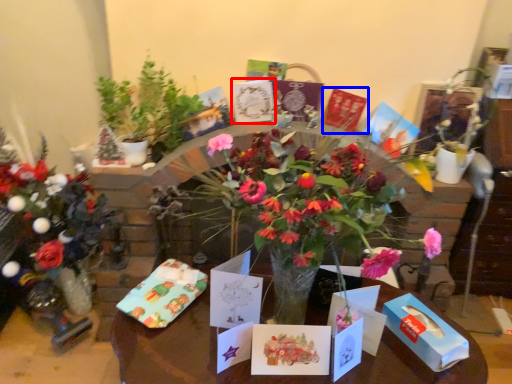
Question: Which object appears farthest to the camera in this image, birthday card (highlighted by a red box) or birthday card (highlighted by a blue box)?

Choices:
 (A) birthday card
 (B) birthday card

Answer: (B)